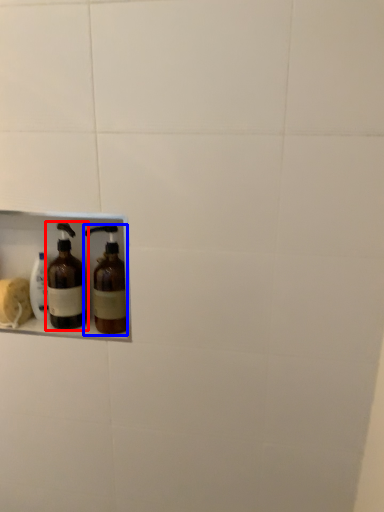
Question: Which of the following is the closest to the observer, bottle (highlighted by a red box) or bottle (highlighted by a blue box)?

Choices:
 (A) bottle
 (B) bottle

Answer: (B)